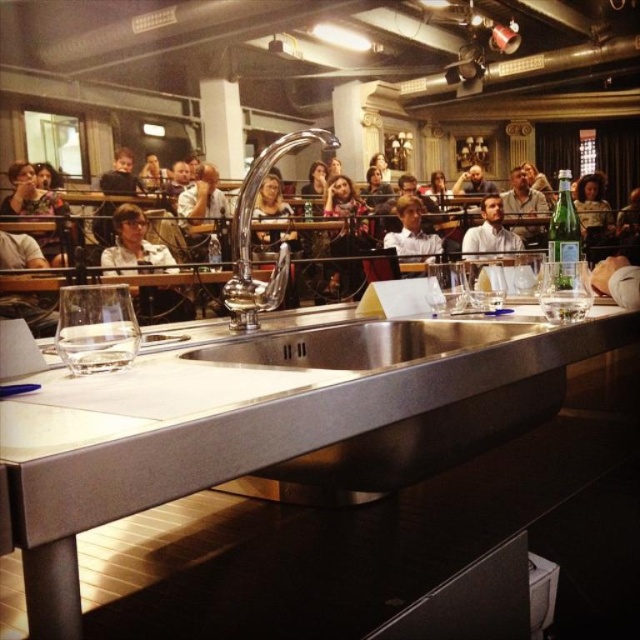
Who is positioned more to the left, stainless steel sink at center or clear glass wine glass at right?

stainless steel sink at center is more to the left.

Can you confirm if stainless steel sink at center is smaller than clear glass wine glass at right?

Incorrect, stainless steel sink at center is not smaller in size than clear glass wine glass at right.

Measure the distance between point (353, 348) and camera.

Point (353, 348) is 1.28 meters away from camera.

Identify the location of stainless steel sink at center. (362, 342).

Between polished chrome faucet at center and clear glass wine glass at right, which one is positioned higher?

polished chrome faucet at center is higher up.

What do you see at coordinates (250, 236) in the screenshot? I see `polished chrome faucet at center` at bounding box center [250, 236].

Locate an element on the screen. The width and height of the screenshot is (640, 640). polished chrome faucet at center is located at coordinates (250, 236).

The height and width of the screenshot is (640, 640). What do you see at coordinates (563, 236) in the screenshot?
I see `green glass bottle at center` at bounding box center [563, 236].

Which is more to the right, green glass bottle at center or transparent glass at center?

From the viewer's perspective, green glass bottle at center appears more on the right side.

The image size is (640, 640). Describe the element at coordinates (563, 236) in the screenshot. I see `green glass bottle at center` at that location.

Where is `green glass bottle at center`? Image resolution: width=640 pixels, height=640 pixels. green glass bottle at center is located at coordinates (563, 236).